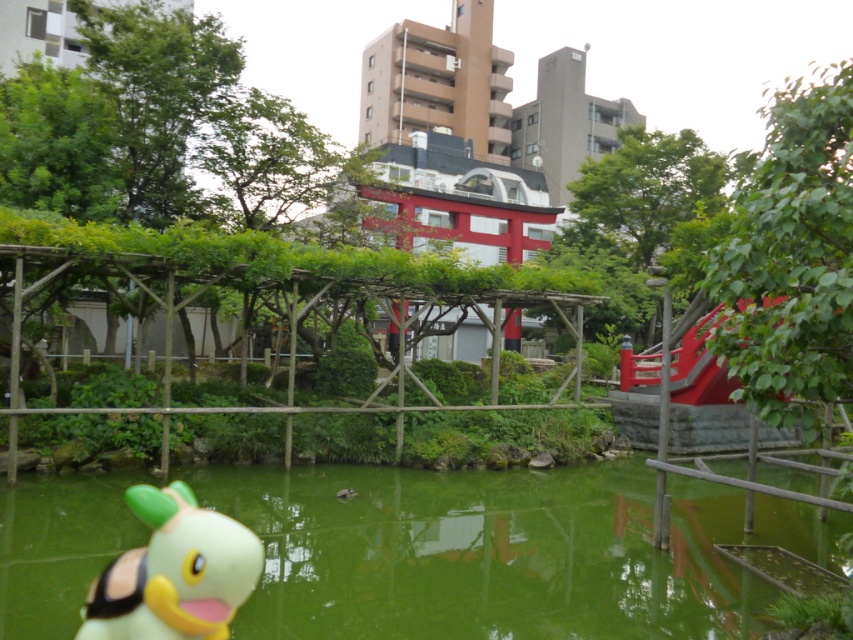
You are standing in the park and see the yellow matte plush toy at lower left and the wooden trellis at center. Which object is positioned more to the right from your perspective?

The yellow matte plush toy at lower left is positioned more to the right than the wooden trellis at center.

From the picture: You are a park visitor who wants to know if the green liquid water at center is deeper than the wooden trellis at center. Based on the scene, can you determine which one is taller?

The green liquid water at center has a lesser height compared to wooden trellis at center, so the wooden trellis at center is taller.